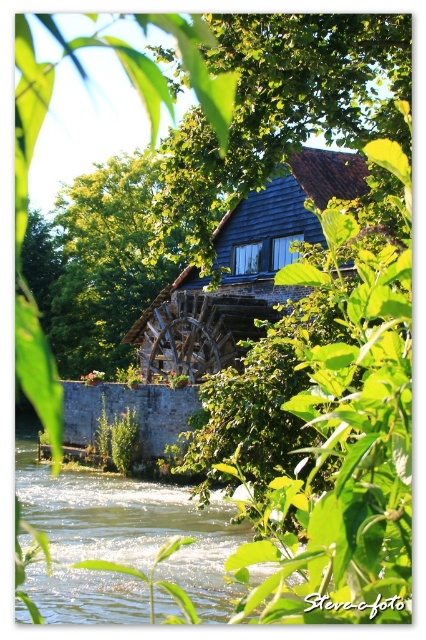
Question: Considering the real-world distances, which object is farthest from the green leafy tree at upper center?

Choices:
 (A) green leafy tree at center
 (B) green water at lower left

Answer: (B)

Question: Which point is closer to the camera?

Choices:
 (A) green leafy tree at center
 (B) green water at lower left
 (C) green leafy tree at upper center

Answer: (B)

Question: Can you confirm if green water at lower left is wider than green leafy tree at center?

Choices:
 (A) yes
 (B) no

Answer: (A)

Question: Based on their relative distances, which object is farther from the green water at lower left?

Choices:
 (A) green leafy tree at upper center
 (B) green leafy tree at center

Answer: (B)

Question: Can you confirm if green leafy tree at upper center is smaller than green leafy tree at center?

Choices:
 (A) no
 (B) yes

Answer: (B)

Question: Can you confirm if green leafy tree at upper center is positioned to the left of green leafy tree at center?

Choices:
 (A) no
 (B) yes

Answer: (A)